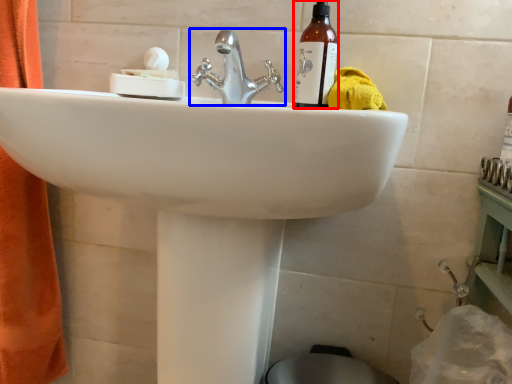
Question: Which point is further to the camera, bottle (highlighted by a red box) or tap (highlighted by a blue box)?

Choices:
 (A) bottle
 (B) tap

Answer: (A)